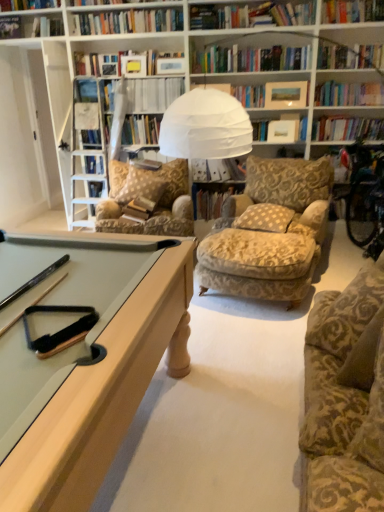
Question: From a real-world perspective, is gold-patterned fabric chair at center positioned under hardcover book at upper center, the first book when ordered from top to bottom, based on gravity?

Choices:
 (A) yes
 (B) no

Answer: (A)

Question: Does gold-patterned fabric chair at center have a larger size compared to hardcover book at upper center, the first book when ordered from top to bottom?

Choices:
 (A) yes
 (B) no

Answer: (A)

Question: Is hardcover book at upper center, the first book when ordered from top to bottom, at the back of gold-patterned fabric chair at center?

Choices:
 (A) no
 (B) yes

Answer: (A)

Question: Does gold-patterned fabric chair at center have a lesser width compared to hardcover book at upper center, the first book when ordered from top to bottom?

Choices:
 (A) yes
 (B) no

Answer: (B)

Question: Can you confirm if gold-patterned fabric chair at center is shorter than hardcover book at upper center, the first book when ordered from top to bottom?

Choices:
 (A) no
 (B) yes

Answer: (A)

Question: Are gold-patterned fabric chair at center and hardcover book at upper center, the first book when ordered from top to bottom, making contact?

Choices:
 (A) yes
 (B) no

Answer: (B)

Question: Is hardcover book at upper center, which is the 4th book from bottom to top, looking in the opposite direction of hardcover book at center, which appears as the fourth book when viewed from the top?

Choices:
 (A) no
 (B) yes

Answer: (A)

Question: Is hardcover book at upper center, which is the 4th book from bottom to top, at the left side of hardcover book at center, positioned as the 1th book in bottom-to-top order?

Choices:
 (A) yes
 (B) no

Answer: (A)

Question: Does hardcover book at upper center, the first book when ordered from top to bottom, have a greater width compared to hardcover book at center, positioned as the 1th book in bottom-to-top order?

Choices:
 (A) no
 (B) yes

Answer: (A)

Question: Can you confirm if hardcover book at upper center, the first book when ordered from top to bottom, is shorter than hardcover book at center, which appears as the fourth book when viewed from the top?

Choices:
 (A) no
 (B) yes

Answer: (B)

Question: Can you confirm if hardcover book at upper center, which is the 4th book from bottom to top, is bigger than hardcover book at center, which appears as the fourth book when viewed from the top?

Choices:
 (A) no
 (B) yes

Answer: (A)

Question: Is hardcover book at upper center, the first book when ordered from top to bottom, closer to the viewer compared to hardcover book at center, positioned as the 1th book in bottom-to-top order?

Choices:
 (A) yes
 (B) no

Answer: (A)

Question: Does hardcover book at upper center, which is the 4th book from bottom to top, come behind white paper at upper center, arranged as the second book when viewed from the top?

Choices:
 (A) yes
 (B) no

Answer: (B)